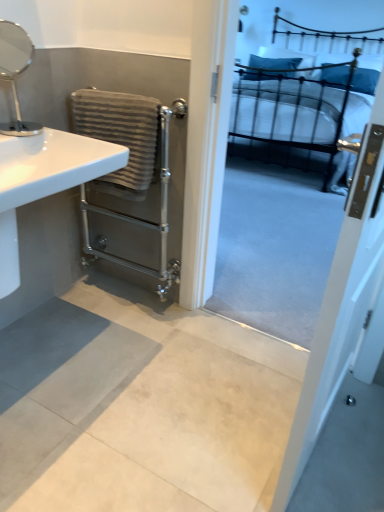
The height and width of the screenshot is (512, 384). What do you see at coordinates (15, 72) in the screenshot? I see `silver metallic mirror at upper left` at bounding box center [15, 72].

The height and width of the screenshot is (512, 384). Describe the element at coordinates (121, 136) in the screenshot. I see `gray textured towel at left` at that location.

Where is `metallic black bed at upper right`? This screenshot has width=384, height=512. metallic black bed at upper right is located at coordinates (305, 90).

Identify the location of silver metallic mirror at upper left. The height and width of the screenshot is (512, 384). (15, 72).

Is gray textured towel at left beside metallic black bed at upper right?

No, gray textured towel at left is not next to metallic black bed at upper right.

Can you tell me how much gray textured towel at left and metallic black bed at upper right differ in facing direction?

The facing directions of gray textured towel at left and metallic black bed at upper right are 1.01 degrees apart.

Who is bigger, gray textured towel at left or metallic black bed at upper right?

metallic black bed at upper right is bigger.

Could metallic black bed at upper right be considered to be inside gray textured towel at left?

That's incorrect, metallic black bed at upper right is not inside gray textured towel at left.

How different are the orientations of metallic black bed at upper right and gray textured towel at left in degrees?

They differ by 1.01 degrees in their facing directions.

Which of these two, metallic black bed at upper right or gray textured towel at left, is bigger?

With larger size is metallic black bed at upper right.

From the picture: From the image's perspective, which is below, metallic black bed at upper right or gray textured towel at left?

gray textured towel at left, from the image's perspective.

Locate an element on the screen. This screenshot has width=384, height=512. bed that appears below the gray textured towel at left (from a real-world perspective) is located at coordinates (305, 90).

Does gray textured towel at left have a greater width compared to white glossy screen door at upper right?

Yes, gray textured towel at left is wider than white glossy screen door at upper right.

Can you see gray textured towel at left touching white glossy screen door at upper right?

No, gray textured towel at left is not making contact with white glossy screen door at upper right.

Is gray textured towel at left positioned before white glossy screen door at upper right?

No, gray textured towel at left is further to the viewer.

Considering the sizes of white glossy screen door at upper right and metallic black bed at upper right in the image, is white glossy screen door at upper right bigger or smaller than metallic black bed at upper right?

white glossy screen door at upper right is smaller than metallic black bed at upper right.

Is white glossy screen door at upper right far from metallic black bed at upper right?

white glossy screen door at upper right is positioned a significant distance from metallic black bed at upper right.

From a real-world perspective, which object stands above the other?

From a 3D spatial view, metallic black bed at upper right is above.

Does white glossy screen door at upper right appear on the left side of metallic black bed at upper right?

Indeed, white glossy screen door at upper right is positioned on the left side of metallic black bed at upper right.

Considering the sizes of objects white glossy sink at left and gray textured towel at left in the image provided, who is smaller, white glossy sink at left or gray textured towel at left?

Smaller between the two is gray textured towel at left.

Consider the image. From the image's perspective, between white glossy sink at left and gray textured towel at left, which one is located above?

gray textured towel at left, from the image's perspective.

Is white glossy sink at left inside or outside of gray textured towel at left?

white glossy sink at left lies outside gray textured towel at left.

Do you think white glossy sink at left is within silver metallic mirror at upper left, or outside of it?

white glossy sink at left cannot be found inside silver metallic mirror at upper left.

From the image's perspective, which is above, white glossy sink at left or silver metallic mirror at upper left?

silver metallic mirror at upper left appears higher in the image.

In the scene shown: Considering their positions, is white glossy sink at left located in front of or behind silver metallic mirror at upper left?

Visually, white glossy sink at left is located in front of silver metallic mirror at upper left.

From a real-world perspective, relative to silver metallic mirror at upper left, is white glossy screen door at upper right vertically above or below?

In terms of real-world spatial position, white glossy screen door at upper right is below silver metallic mirror at upper left.

In the scene shown: Considering their positions, is white glossy screen door at upper right located in front of or behind silver metallic mirror at upper left?

In the image, white glossy screen door at upper right appears in front of silver metallic mirror at upper left.

Consider the image. Does white glossy screen door at upper right have a lesser width compared to silver metallic mirror at upper left?

Indeed, white glossy screen door at upper right has a lesser width compared to silver metallic mirror at upper left.

Would you say white glossy screen door at upper right is outside silver metallic mirror at upper left?

Yes, white glossy screen door at upper right is outside of silver metallic mirror at upper left.

Identify the location of bed above the gray textured towel at left (from the image's perspective). (305, 90).

The image size is (384, 512). I want to click on bath towel above the metallic black bed at upper right (from a real-world perspective), so click(x=121, y=136).

In the scene shown: Based on their spatial positions, is metallic black bed at upper right or white glossy sink at left closer to white glossy screen door at upper right?

The object closer to white glossy screen door at upper right is white glossy sink at left.

Based on their spatial positions, is white glossy sink at left or gray textured towel at left closer to white glossy screen door at upper right?

white glossy sink at left.

From the image, which object appears to be farther from silver metallic mirror at upper left, gray textured towel at left or metallic black bed at upper right?

metallic black bed at upper right lies further to silver metallic mirror at upper left than the other object.

Based on their spatial positions, is metallic black bed at upper right or white glossy sink at left further from gray textured towel at left?

metallic black bed at upper right lies further to gray textured towel at left than the other object.

Looking at the image, which one is located further to white glossy screen door at upper right, white glossy sink at left or silver metallic mirror at upper left?

silver metallic mirror at upper left is further to white glossy screen door at upper right.

Which object lies further to the anchor point silver metallic mirror at upper left, white glossy sink at left or gray textured towel at left?

gray textured towel at left is further to silver metallic mirror at upper left.

Considering their positions, is metallic black bed at upper right positioned closer to white glossy screen door at upper right than gray textured towel at left?

gray textured towel at left is positioned closer to the anchor white glossy screen door at upper right.

Estimate the real-world distances between objects in this image. Which object is closer to white glossy sink at left, white glossy screen door at upper right or silver metallic mirror at upper left?

Among the two, silver metallic mirror at upper left is located nearer to white glossy sink at left.

Locate an element on the screen. This screenshot has height=512, width=384. mirror located between white glossy screen door at upper right and metallic black bed at upper right in the depth direction is located at coordinates tap(15, 72).

You are a GUI agent. You are given a task and a screenshot of the screen. Output one action in this format:
    pyautogui.click(x=<x>, y=<y>)
    Task: Click on the bath towel between white glossy sink at left and metallic black bed at upper right from left to right
    This screenshot has height=512, width=384.
    Given the screenshot: What is the action you would take?
    pyautogui.click(x=121, y=136)

The width and height of the screenshot is (384, 512). I want to click on bath towel situated between silver metallic mirror at upper left and metallic black bed at upper right from left to right, so click(x=121, y=136).

Where is `bath towel between white glossy screen door at upper right and metallic black bed at upper right from front to back`? The image size is (384, 512). bath towel between white glossy screen door at upper right and metallic black bed at upper right from front to back is located at coordinates (121, 136).